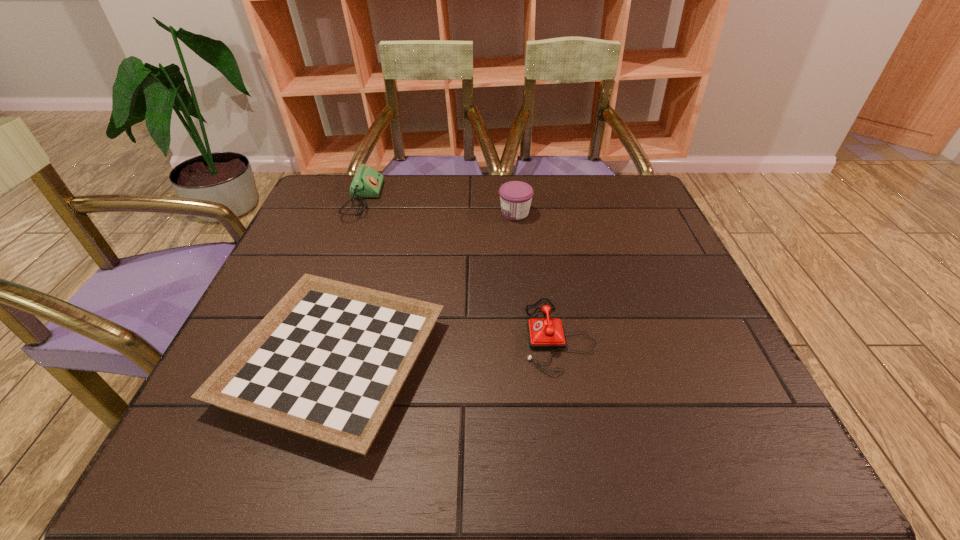
You are a GUI agent. You are given a task and a screenshot of the screen. Output one action in this format:
    pyautogui.click(x=<x>, y=<y>)
    Task: Click on the vacant region that satisfies the following two spatial constraints: 1. on the dial of the third tallest object; 2. on the front side of the shortest object
    This screenshot has width=960, height=540.
    Given the screenshot: What is the action you would take?
    [x=564, y=362]

Find the location of a particular element. This screenshot has width=960, height=540. vacant region that satisfies the following two spatial constraints: 1. on the dial of the left telephone; 2. on the left side of the shortest object is located at coordinates click(304, 362).

Find the location of `blank space that satisfies the following two spatial constraints: 1. on the dial of the farther telephone; 2. on the back side of the shortest object`. blank space that satisfies the following two spatial constraints: 1. on the dial of the farther telephone; 2. on the back side of the shortest object is located at coordinates (304, 362).

What are the coordinates of `free space that satisfies the following two spatial constraints: 1. on the dial of the shortest object; 2. on the left side of the farther telephone` in the screenshot? It's located at pyautogui.click(x=304, y=362).

You are a GUI agent. You are given a task and a screenshot of the screen. Output one action in this format:
    pyautogui.click(x=<x>, y=<y>)
    Task: Click on the blank area in the image that satisfies the following two spatial constraints: 1. on the dial of the farther telephone; 2. on the back side of the checkerboard
    
    Given the screenshot: What is the action you would take?
    pyautogui.click(x=304, y=362)